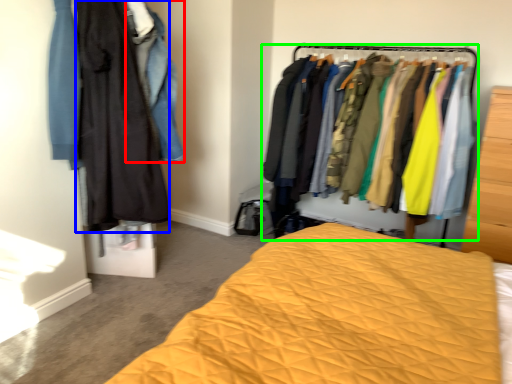
Question: Based on their relative distances, which object is nearer to clothing (highlighted by a red box)? Choose from clothing (highlighted by a blue box) and closet (highlighted by a green box).

Choices:
 (A) clothing
 (B) closet

Answer: (A)